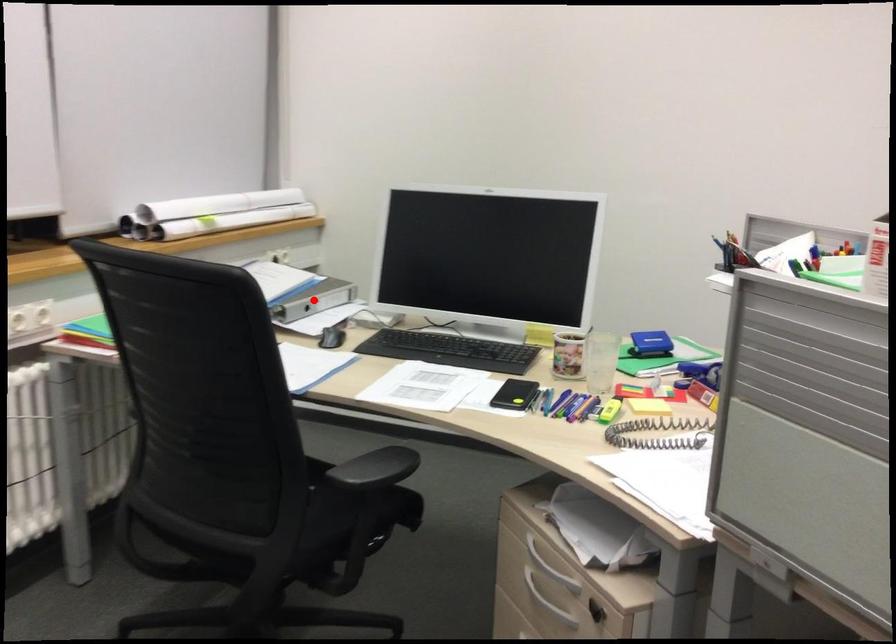
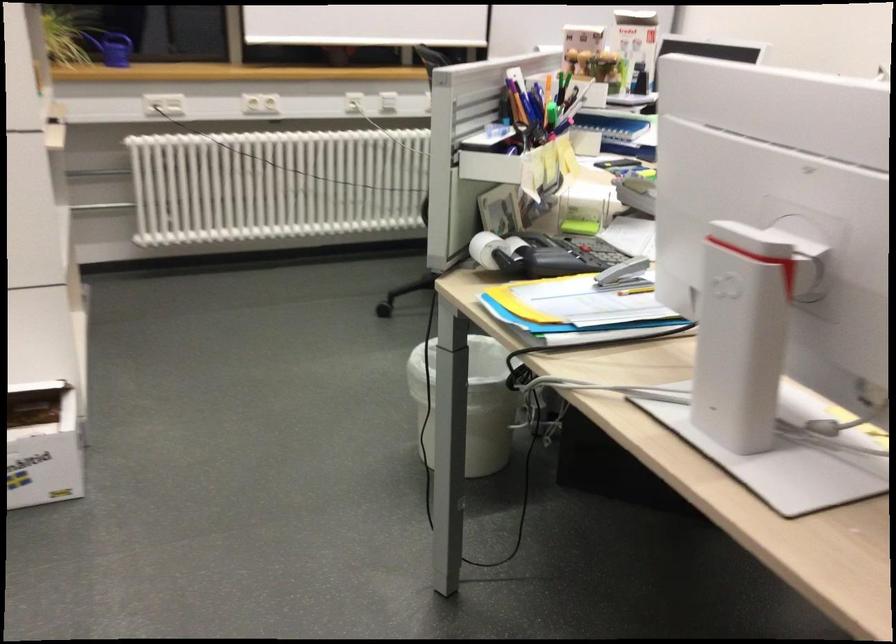
Question: I am providing you with two images of the same scene from different viewpoints. A red point is marked on the first image. At the location where the point appears in image 1, is it still visible in image 2?

Choices:
 (A) Yes
 (B) No

Answer: (B)